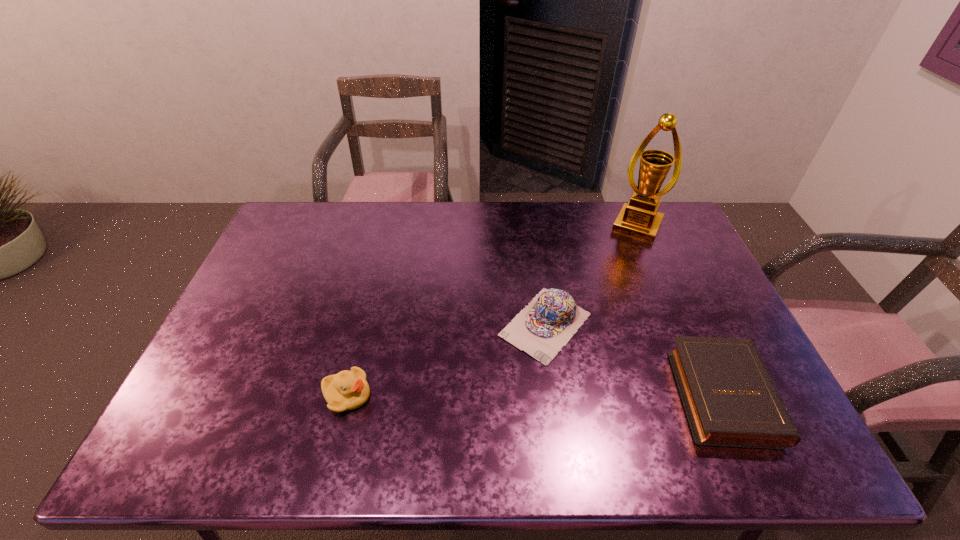
This screenshot has width=960, height=540. I want to click on vacant space on the desktop that is between the leftmost object and the Bible and is positioned on the front-facing side of the farthest object, so click(x=560, y=394).

Where is `free space on the desktop that is between the duckling and the Bible and is positioned on the front, side, and top of the cap`? Image resolution: width=960 pixels, height=540 pixels. free space on the desktop that is between the duckling and the Bible and is positioned on the front, side, and top of the cap is located at coordinates (482, 395).